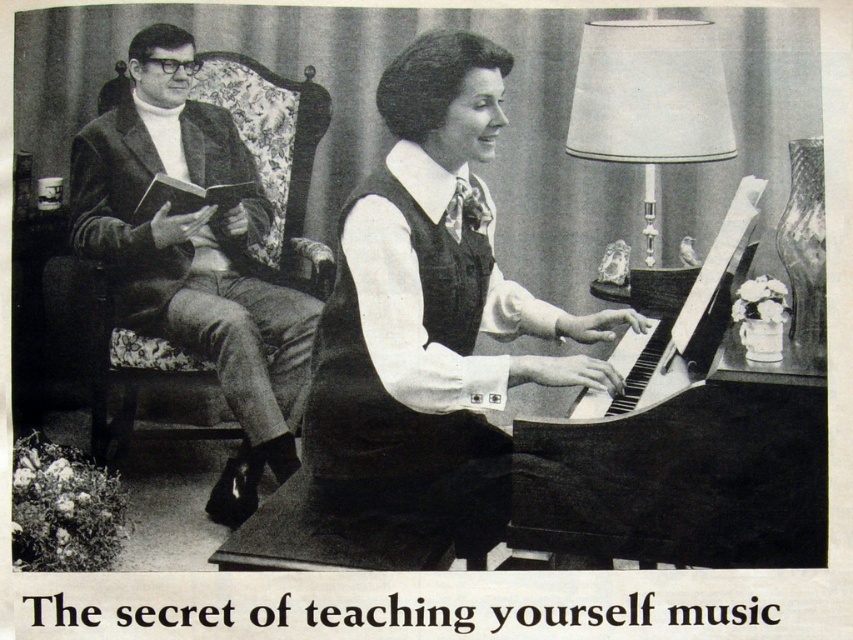
Between matte black piano at center and metallic silver lampshade at upper right, which one appears on the left side from the viewer's perspective?

Positioned to the left is matte black piano at center.

Is matte black piano at center further to camera compared to metallic silver lampshade at upper right?

No, it is in front of metallic silver lampshade at upper right.

Is point (601, 339) positioned before point (610, 64)?

Yes, point (601, 339) is closer to viewer.

I want to click on matte black piano at center, so click(x=431, y=316).

Between matte black piano at center and black polished piano at center, which one is positioned lower?

matte black piano at center

Find the location of a particular element. This screenshot has height=640, width=853. matte black piano at center is located at coordinates (431, 316).

This screenshot has height=640, width=853. Describe the element at coordinates (680, 440) in the screenshot. I see `black polished piano at center` at that location.

Is black polished piano at center bigger than metallic silver lampshade at upper right?

Correct, black polished piano at center is larger in size than metallic silver lampshade at upper right.

Who is more distant from viewer, (590, 452) or (595, 61)?

Point (595, 61)

The height and width of the screenshot is (640, 853). I want to click on black polished piano at center, so click(680, 440).